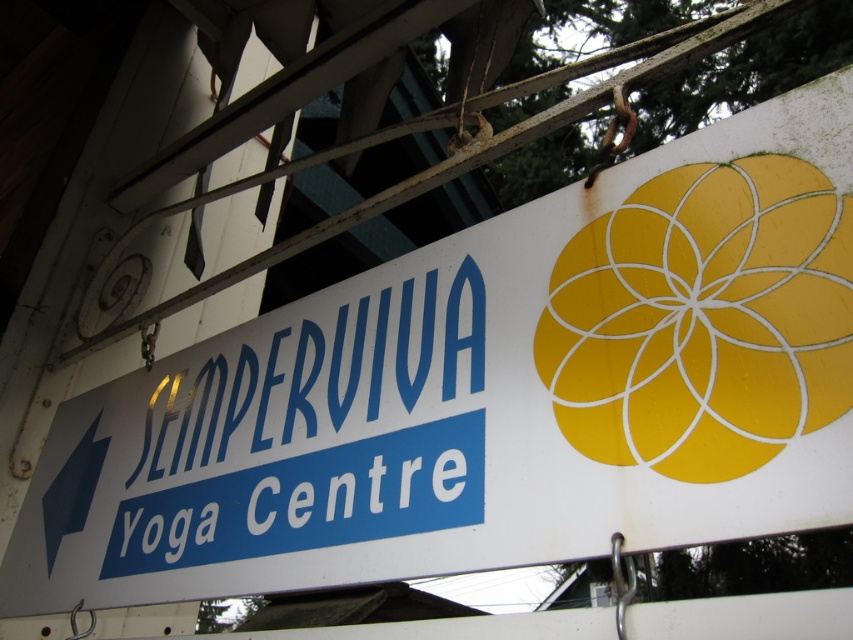
You are a painter standing 1 meter away from the blue metallic sign at center. You need to paint the yellow matte flower at upper right without moving closer. Can you reach it with your 1.2 meter long paintbrush?

The distance between the yellow matte flower at upper right and the blue metallic sign at center is 30.66 centimeters. Since you are 1 meter away from the sign, the total distance to the flower is approximately 130.66 centimeters. Your paintbrush is 1.2 meters long, which is 120 centimeters. Therefore, you cannot reach the flower without moving closer.